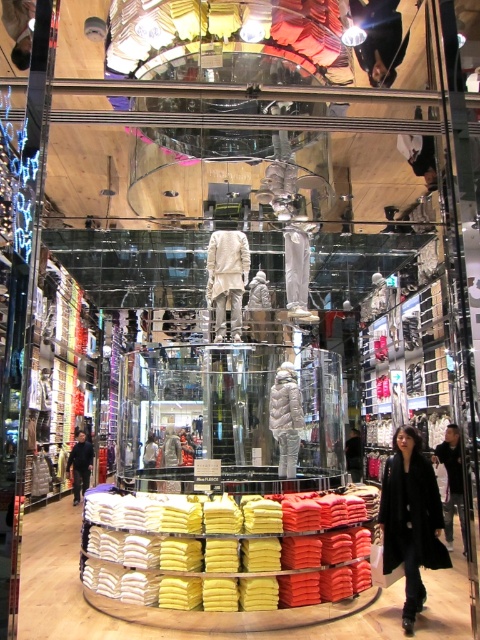
Question: Which is farther from the white glossy mannequin at center?

Choices:
 (A) black fabric jacket at lower left
 (B) black wool coat at lower right
 (C) white down jacket at center

Answer: (A)

Question: Does black wool coat at lower right have a lesser width compared to white down jacket at center?

Choices:
 (A) no
 (B) yes

Answer: (A)

Question: Which point is farther to the camera?

Choices:
 (A) white glossy mannequin at center
 (B) black leather coat at lower right
 (C) white down jacket at center
 (D) black fabric jacket at lower left

Answer: (D)

Question: Is white down jacket at center to the left of black leather coat at lower right from the viewer's perspective?

Choices:
 (A) no
 (B) yes

Answer: (B)

Question: Which object is closer to the camera taking this photo?

Choices:
 (A) white glossy mannequin at center
 (B) clear acrylic display at center
 (C) black fabric jacket at lower left

Answer: (A)

Question: Does white glossy mannequin at center appear over black fabric jacket at lower left?

Choices:
 (A) yes
 (B) no

Answer: (A)